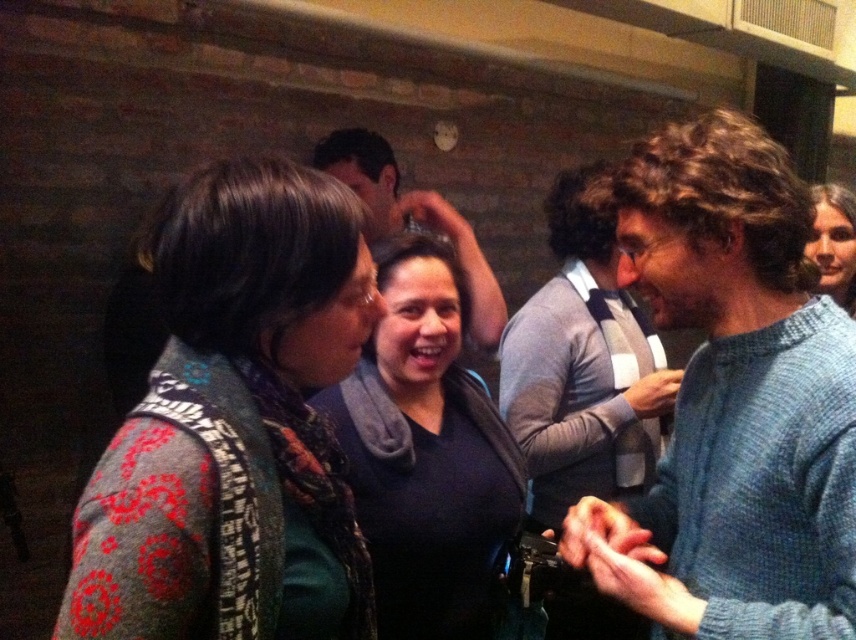
You are a photographer at the event and want to take a photo of both the dark blue sweater at center and the smooth skin face at upper right. The camera you are using has a minimum focus distance of 3 feet. Can you capture both subjects clearly in the same photo without moving either the camera or the subjects?

The dark blue sweater at center is 3.36 feet away from the smooth skin face at upper right. Since the minimum focus distance is 3 feet, the camera can focus on both subjects as the distance between them is greater than the minimum requirement, allowing both to be in focus simultaneously.

You are at a party and want to take a photo of the dark blue sweater at center and the smooth skin face at upper right. Which object should you focus on first if you want to capture both in the same frame without moving the camera?

You should focus on the dark blue sweater at center first because it is taller than the smooth skin face at upper right, ensuring it is in focus while the face remains within the frame.

You are at a party and see two people wearing sweaters. The first person is wearing a knitted sweater at left, and the second is wearing a dark blue sweater at center. Which sweater is covering the other?

The knitted sweater at left is positioned over the dark blue sweater at center, so it is covering the dark blue sweater at center.